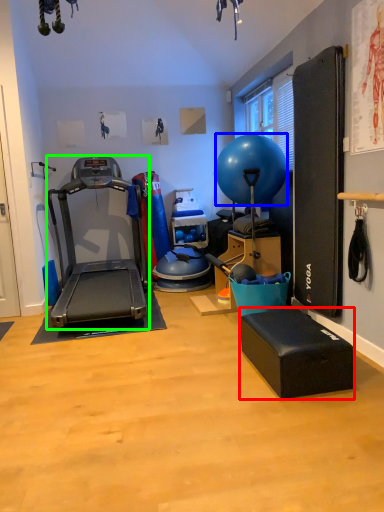
Question: Based on their relative distances, which object is farther from footrest (highlighted by a red box)? Choose from ball (highlighted by a blue box) and treadmill (highlighted by a green box).

Choices:
 (A) ball
 (B) treadmill

Answer: (B)